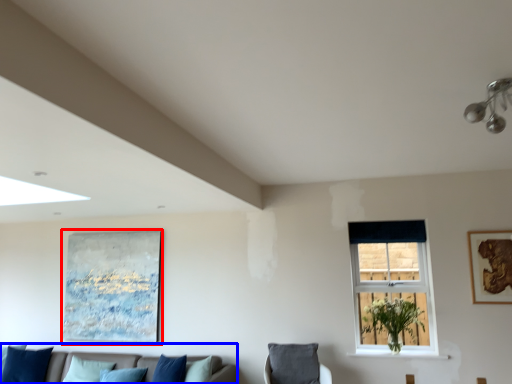
Question: Which of the following is the farthest to the observer, picture frame (highlighted by a red box) or studio couch (highlighted by a blue box)?

Choices:
 (A) picture frame
 (B) studio couch

Answer: (A)